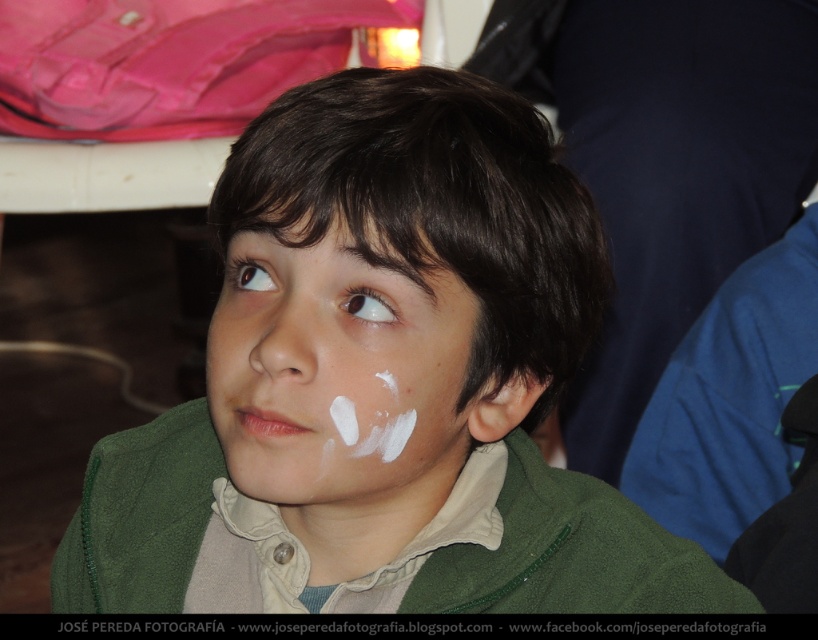
Question: Which point appears closest to the camera in this image?

Choices:
 (A) (349, 296)
 (B) (468, 358)
 (C) (268, 380)
 (D) (237, 282)

Answer: (C)

Question: Does smooth white nose at center have a smaller size compared to white matte eye at center?

Choices:
 (A) no
 (B) yes

Answer: (A)

Question: Which object is farther from the camera taking this photo?

Choices:
 (A) smooth white nose at center
 (B) white matte forehead at upper center

Answer: (A)

Question: Is white matte forehead at upper center above brown glossy eye at upper left?

Choices:
 (A) yes
 (B) no

Answer: (A)

Question: Which of the following is the closest to the observer?

Choices:
 (A) (237, 268)
 (B) (282, 294)

Answer: (B)

Question: Observing the image, what is the correct spatial positioning of white matte face at center in reference to brown glossy eye at upper left?

Choices:
 (A) above
 (B) below

Answer: (B)